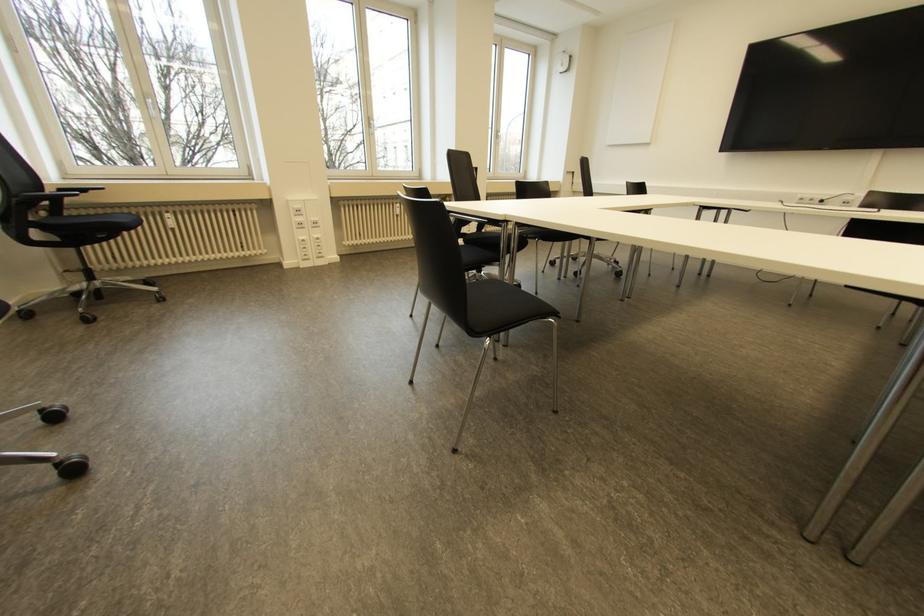
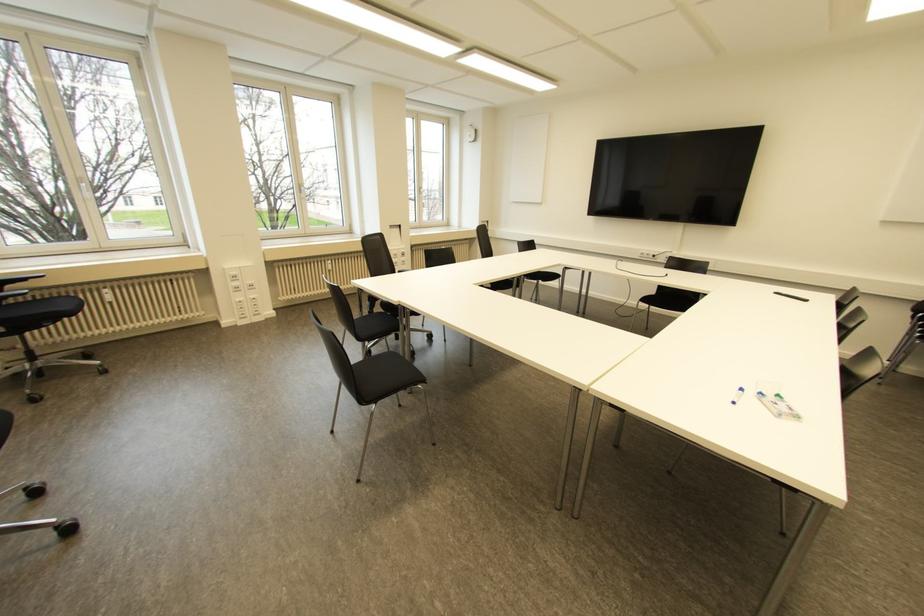
The point at [553,314] is marked in the first image. Where is the corresponding point in the second image?

(422, 381)